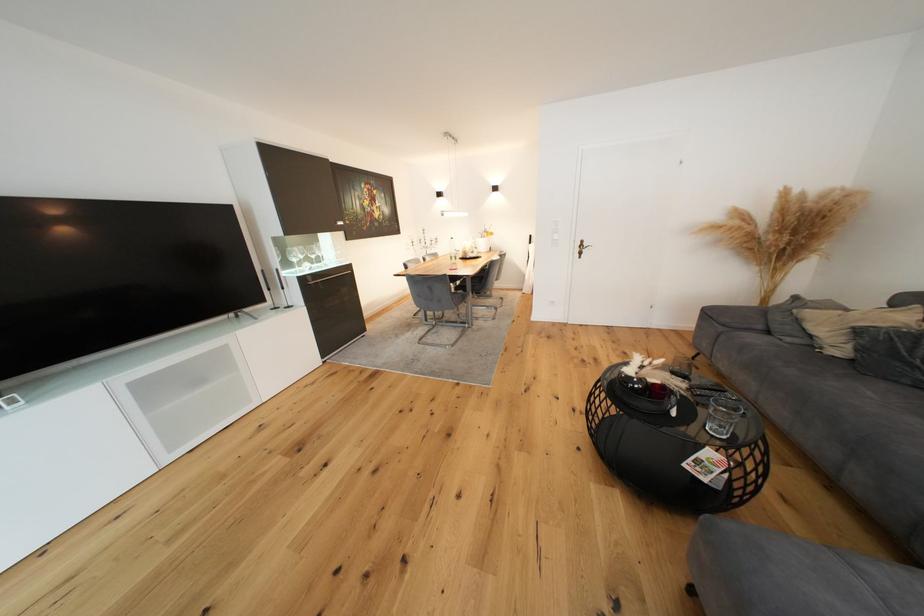
Identify the location of small white vase. (482, 244).